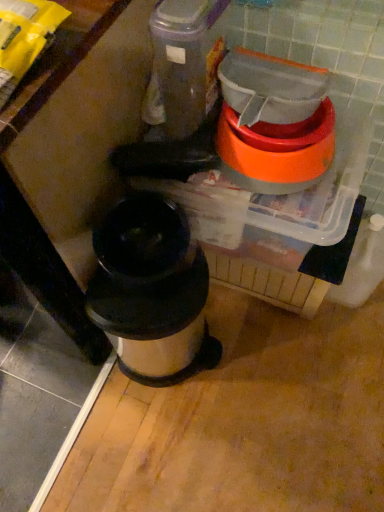
In order to face stainless steel trash can at center, should I rotate leftwards or rightwards?

Rotate your view left by about 3.471°.

Describe the element at coordinates (151, 292) in the screenshot. I see `stainless steel trash can at center` at that location.

This screenshot has width=384, height=512. I want to click on stainless steel trash can at center, so click(x=151, y=292).

At what (x,y) coordinates should I click in order to perform the action: click on orange plastic bowl at upper right. Please return your answer as a coordinate pair (x, y). Looking at the image, I should click on (274, 121).

This screenshot has height=512, width=384. Describe the element at coordinates (274, 121) in the screenshot. I see `orange plastic bowl at upper right` at that location.

Find the location of a particular element. stainless steel trash can at center is located at coordinates (151, 292).

Is stainless steel trash can at center at the right side of orange plastic bowl at upper right?

No, stainless steel trash can at center is not to the right of orange plastic bowl at upper right.

Consider the image. Is stainless steel trash can at center closer to the viewer compared to orange plastic bowl at upper right?

No, it is not.

Which is in front, point (95, 290) or point (262, 79)?

Positioned in front is point (262, 79).

From the image's perspective, would you say stainless steel trash can at center is positioned over orange plastic bowl at upper right?

No.

From a real-world perspective, which is physically above, stainless steel trash can at center or orange plastic bowl at upper right?

orange plastic bowl at upper right.

Does stainless steel trash can at center have a greater width compared to orange plastic bowl at upper right?

Yes.

Is stainless steel trash can at center taller than orange plastic bowl at upper right?

Yes.

Considering the relative sizes of stainless steel trash can at center and orange plastic bowl at upper right in the image provided, is stainless steel trash can at center smaller than orange plastic bowl at upper right?

No.

Is stainless steel trash can at center situated inside orange plastic bowl at upper right or outside?

stainless steel trash can at center lies outside orange plastic bowl at upper right.

Is stainless steel trash can at center positioned far away from orange plastic bowl at upper right?

No.

Does stainless steel trash can at center turn towards orange plastic bowl at upper right?

No, stainless steel trash can at center does not turn towards orange plastic bowl at upper right.

How distant is stainless steel trash can at center from orange plastic bowl at upper right?

They are 33.02 centimeters apart.

The image size is (384, 512). I want to click on waste container that is under the orange plastic bowl at upper right (from a real-world perspective), so click(151, 292).

Considering the relative positions of orange plastic bowl at upper right and stainless steel trash can at center in the image provided, is orange plastic bowl at upper right to the left or to the right of stainless steel trash can at center?

From the image, it's evident that orange plastic bowl at upper right is to the right of stainless steel trash can at center.

Does orange plastic bowl at upper right come behind stainless steel trash can at center?

No, orange plastic bowl at upper right is in front of stainless steel trash can at center.

Is point (236, 104) farther from viewer compared to point (145, 245)?

No, it is in front of (145, 245).

From the image's perspective, would you say orange plastic bowl at upper right is positioned over stainless steel trash can at center?

Yes, from the image's perspective, orange plastic bowl at upper right is above stainless steel trash can at center.

From a real-world perspective, is orange plastic bowl at upper right physically below stainless steel trash can at center?

No.

Does orange plastic bowl at upper right have a greater width compared to stainless steel trash can at center?

Incorrect, the width of orange plastic bowl at upper right does not surpass that of stainless steel trash can at center.

Is orange plastic bowl at upper right taller or shorter than stainless steel trash can at center?

In the image, orange plastic bowl at upper right appears to be shorter than stainless steel trash can at center.

Looking at the image, does orange plastic bowl at upper right seem bigger or smaller compared to stainless steel trash can at center?

In the image, orange plastic bowl at upper right appears to be smaller than stainless steel trash can at center.

Is orange plastic bowl at upper right positioned beyond the bounds of stainless steel trash can at center?

Yes.

Is orange plastic bowl at upper right far from stainless steel trash can at center?

orange plastic bowl at upper right is actually quite close to stainless steel trash can at center.

Is orange plastic bowl at upper right looking in the opposite direction of stainless steel trash can at center?

That's not correct — orange plastic bowl at upper right is not looking away from stainless steel trash can at center.

In order to click on waste container located below the orange plastic bowl at upper right (from the image's perspective) in this screenshot , I will do `click(151, 292)`.

Where is `appliance on the right of stainless steel trash can at center`? This screenshot has height=512, width=384. appliance on the right of stainless steel trash can at center is located at coordinates (274, 121).

Image resolution: width=384 pixels, height=512 pixels. What are the coordinates of `waste container below the orange plastic bowl at upper right (from the image's perspective)` in the screenshot? It's located at (151, 292).